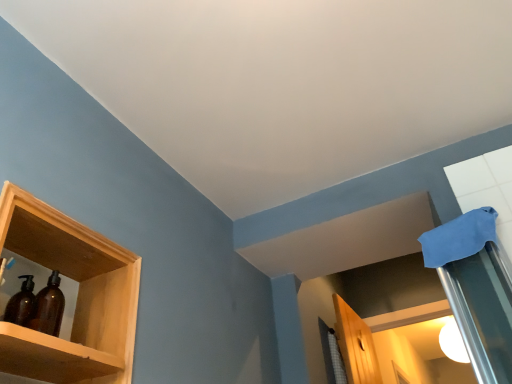
Question: Is wooden shelf at left thinner than amber glass bottles at left?

Choices:
 (A) no
 (B) yes

Answer: (A)

Question: Can we say wooden shelf at left lies outside amber glass bottles at left?

Choices:
 (A) yes
 (B) no

Answer: (A)

Question: From the image's perspective, is wooden shelf at left below amber glass bottles at left?

Choices:
 (A) no
 (B) yes

Answer: (B)

Question: From a real-world perspective, does wooden shelf at left sit lower than amber glass bottles at left?

Choices:
 (A) no
 (B) yes

Answer: (A)

Question: Can you confirm if wooden shelf at left is taller than amber glass bottles at left?

Choices:
 (A) no
 (B) yes

Answer: (B)

Question: In terms of height, does white glossy light bulb at upper right look taller or shorter compared to amber glass bottles at left?

Choices:
 (A) tall
 (B) short

Answer: (A)

Question: In terms of size, does white glossy light bulb at upper right appear bigger or smaller than amber glass bottles at left?

Choices:
 (A) big
 (B) small

Answer: (A)

Question: Considering the positions of white glossy light bulb at upper right and amber glass bottles at left in the image, is white glossy light bulb at upper right wider or thinner than amber glass bottles at left?

Choices:
 (A) thin
 (B) wide

Answer: (B)

Question: Visually, is white glossy light bulb at upper right positioned to the left or to the right of amber glass bottles at left?

Choices:
 (A) right
 (B) left

Answer: (A)

Question: Is wooden shelf at left to the left or to the right of white glossy light bulb at upper right in the image?

Choices:
 (A) right
 (B) left

Answer: (B)

Question: Looking at the image, does wooden shelf at left seem bigger or smaller compared to white glossy light bulb at upper right?

Choices:
 (A) small
 (B) big

Answer: (B)

Question: From a real-world perspective, is wooden shelf at left physically located above or below white glossy light bulb at upper right?

Choices:
 (A) above
 (B) below

Answer: (B)

Question: Does point (105, 339) appear closer or farther from the camera than point (453, 359)?

Choices:
 (A) farther
 (B) closer

Answer: (B)

Question: From a real-world perspective, relative to white glossy light bulb at upper right, is amber glass bottles at left vertically above or below?

Choices:
 (A) above
 (B) below

Answer: (B)

Question: In terms of height, does amber glass bottles at left look taller or shorter compared to white glossy light bulb at upper right?

Choices:
 (A) short
 (B) tall

Answer: (A)